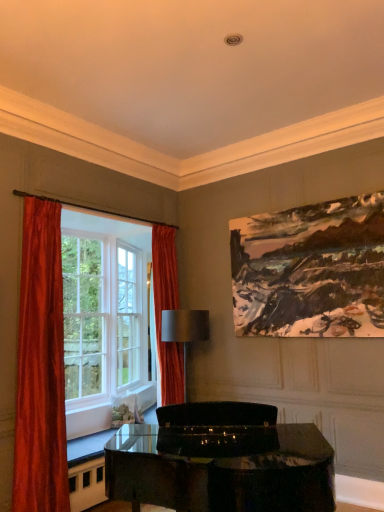
Question: Considering the relative positions of orange velvet curtain at left, which appears as the 1th curtain when viewed from the back, and velvet orange curtain at left, which ranks as the first curtain in left-to-right order, in the image provided, is orange velvet curtain at left, which appears as the 1th curtain when viewed from the back, to the right of velvet orange curtain at left, which ranks as the first curtain in left-to-right order, from the viewer's perspective?

Choices:
 (A) no
 (B) yes

Answer: (B)

Question: Does orange velvet curtain at left, which appears as the 1th curtain when viewed from the back, have a larger size compared to velvet orange curtain at left, the first curtain positioned from the front?

Choices:
 (A) yes
 (B) no

Answer: (A)

Question: From a real-world perspective, does orange velvet curtain at left, which appears as the 1th curtain when viewed from the back, stand above velvet orange curtain at left, which ranks as the first curtain in left-to-right order?

Choices:
 (A) yes
 (B) no

Answer: (A)

Question: Considering the relative sizes of orange velvet curtain at left, which appears as the first curtain when viewed from the right, and velvet orange curtain at left, which ranks as the first curtain in left-to-right order, in the image provided, is orange velvet curtain at left, which appears as the first curtain when viewed from the right, thinner than velvet orange curtain at left, which ranks as the first curtain in left-to-right order,?

Choices:
 (A) no
 (B) yes

Answer: (A)

Question: Does orange velvet curtain at left, which appears as the 1th curtain when viewed from the back, come in front of velvet orange curtain at left, placed as the 2th curtain when sorted from back to front?

Choices:
 (A) yes
 (B) no

Answer: (B)

Question: In terms of height, does glossy black piano at center look taller or shorter compared to oil painting at upper right?

Choices:
 (A) tall
 (B) short

Answer: (B)

Question: From the image's perspective, is glossy black piano at center located above or below oil painting at upper right?

Choices:
 (A) below
 (B) above

Answer: (A)

Question: From a real-world perspective, is glossy black piano at center above or below oil painting at upper right?

Choices:
 (A) below
 (B) above

Answer: (A)

Question: Based on their sizes in the image, would you say glossy black piano at center is bigger or smaller than oil painting at upper right?

Choices:
 (A) big
 (B) small

Answer: (A)

Question: Does point (39, 322) appear closer or farther from the camera than point (115, 370)?

Choices:
 (A) closer
 (B) farther

Answer: (A)

Question: From a real-world perspective, is velvet orange curtain at left, placed as the 2th curtain when sorted from back to front, positioned above or below silky red curtains at left?

Choices:
 (A) above
 (B) below

Answer: (B)

Question: Based on their positions, is velvet orange curtain at left, the second curtain viewed from the right, located to the left or right of silky red curtains at left?

Choices:
 (A) right
 (B) left

Answer: (B)

Question: Is velvet orange curtain at left, the first curtain positioned from the front, taller or shorter than silky red curtains at left?

Choices:
 (A) tall
 (B) short

Answer: (A)

Question: Looking at the image, does orange velvet curtain at left, which appears as the 1th curtain when viewed from the back, seem bigger or smaller compared to satin gray lampshade at center?

Choices:
 (A) big
 (B) small

Answer: (A)

Question: In terms of width, does orange velvet curtain at left, which appears as the 1th curtain when viewed from the back, look wider or thinner when compared to satin gray lampshade at center?

Choices:
 (A) wide
 (B) thin

Answer: (B)